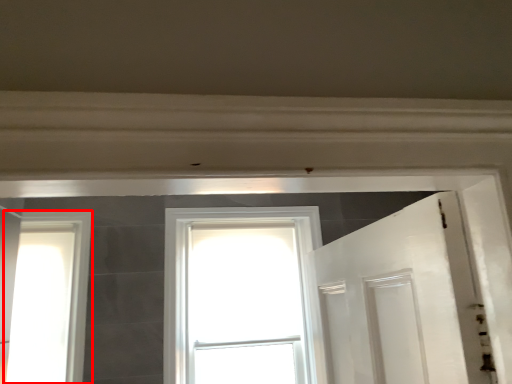
Question: From the image's perspective, what is the correct spatial relationship of window (annotated by the red box) in relation to window?

Choices:
 (A) above
 (B) below

Answer: (A)